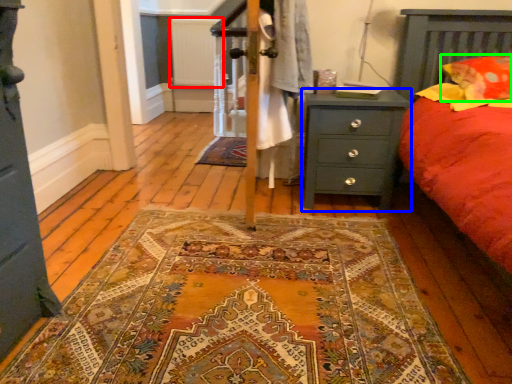
Question: Which object is the farthest from radiator (highlighted by a red box)? Choose among these: nightstand (highlighted by a blue box) or pillow (highlighted by a green box).

Choices:
 (A) nightstand
 (B) pillow

Answer: (B)